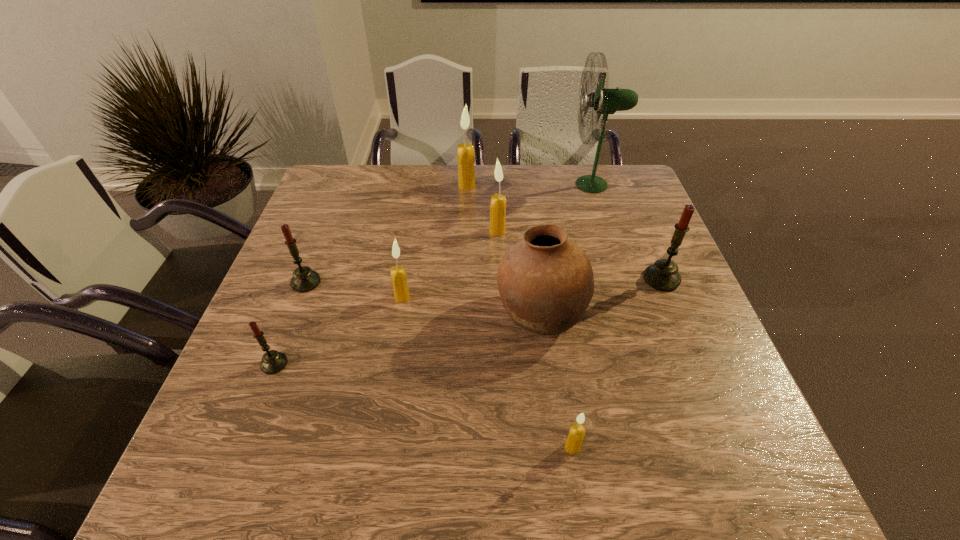
The width and height of the screenshot is (960, 540). Find the location of `fan situated at the right edge`. fan situated at the right edge is located at coordinates (605, 101).

Identify the location of candle that is at the right edge. The height and width of the screenshot is (540, 960). (663, 275).

At what (x,y) coordinates should I click in order to perform the action: click on object that is positioned at the far right corner. Please return your answer as a coordinate pair (x, y). Looking at the image, I should click on (605, 101).

I want to click on vacant region at the far edge of the desktop, so click(480, 199).

Identify the location of vacant space at the near edge of the desktop. (427, 480).

This screenshot has height=540, width=960. In the image, there is a desktop. In order to click on vacant region at the left edge in this screenshot , I will do `click(328, 300)`.

This screenshot has height=540, width=960. Identify the location of free region at the right edge. (695, 337).

I want to click on vacant point at the far left corner, so click(375, 172).

In the image, there is a desktop. Where is `vacant space at the near left corner`? Image resolution: width=960 pixels, height=540 pixels. vacant space at the near left corner is located at coordinates (225, 446).

The width and height of the screenshot is (960, 540). Find the location of `free space at the far right corner`. free space at the far right corner is located at coordinates (617, 175).